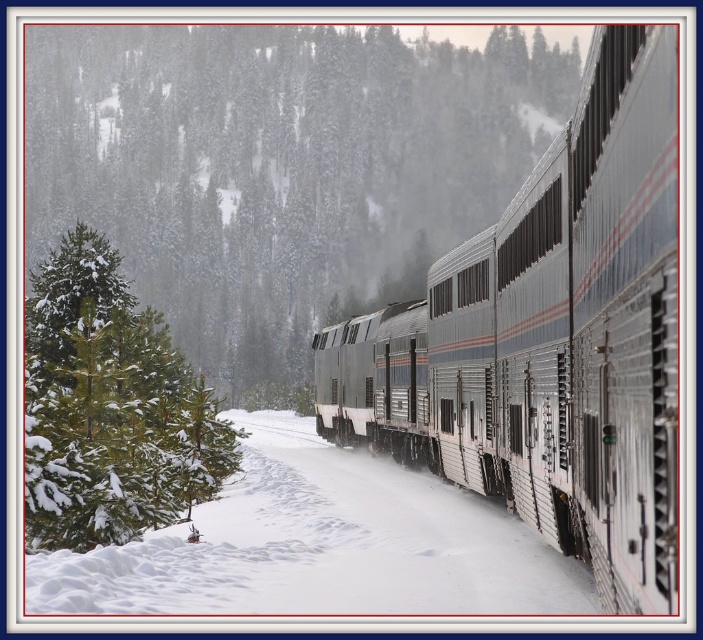
Can you confirm if silver metallic train at right is positioned to the left of green matte evergreen tree at left?

Incorrect, silver metallic train at right is not on the left side of green matte evergreen tree at left.

Is silver metallic train at right in front of green matte evergreen tree at left?

That is True.

Is point (645, 497) behind point (155, 378)?

No, it is in front of (155, 378).

At what (x,y) coordinates should I click in order to perform the action: click on silver metallic train at right. Please return your answer as a coordinate pair (x, y). The height and width of the screenshot is (640, 703). Looking at the image, I should click on (555, 337).

At what (x,y) coordinates should I click in order to perform the action: click on white powdery snow at lower center. Please return your answer as a coordinate pair (x, y). Looking at the image, I should click on (321, 545).

Is point (299, 584) positioned in front of point (169, 444)?

Yes.

Where is `white powdery snow at lower center`? white powdery snow at lower center is located at coordinates (321, 545).

Who is taller, silver metallic train at right or white powdery snow at lower center?

silver metallic train at right is taller.

Is silver metallic train at right thinner than white powdery snow at lower center?

Correct, silver metallic train at right's width is less than white powdery snow at lower center's.

Locate an element on the screen. This screenshot has height=640, width=703. silver metallic train at right is located at coordinates (555, 337).